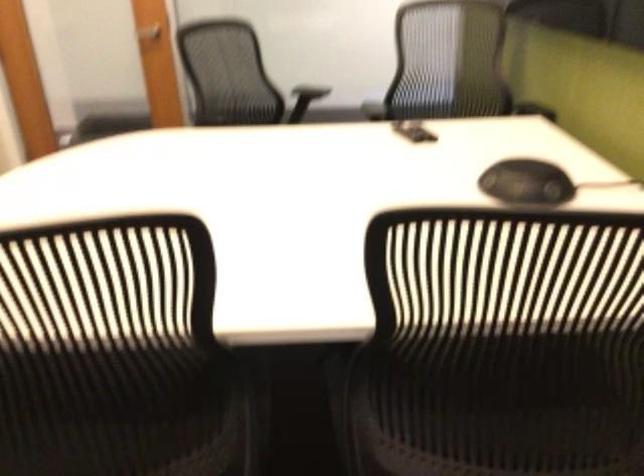
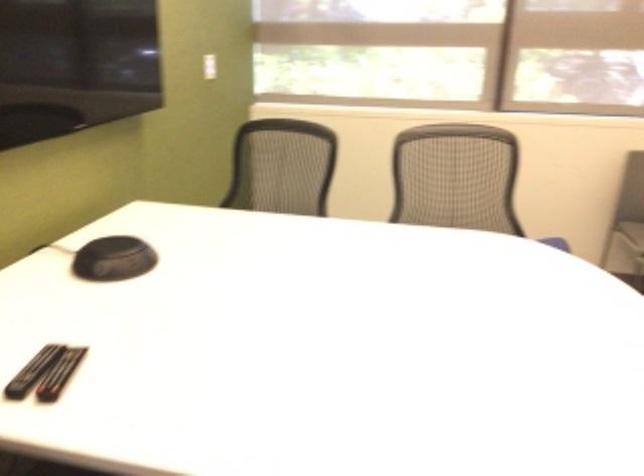
Locate, in the second image, the point that corresponds to point 406,130 in the first image.

(59, 374)